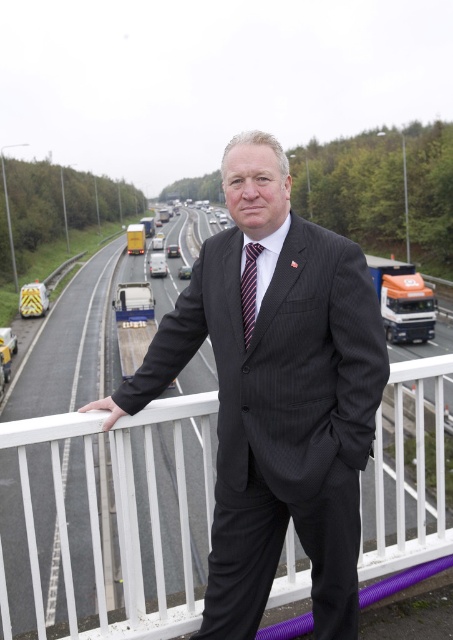
Does black pinstripe suit at center have a greater width compared to striped fabric tie at center?

Yes, black pinstripe suit at center is wider than striped fabric tie at center.

Can you confirm if black pinstripe suit at center is positioned above striped fabric tie at center?

No, black pinstripe suit at center is not above striped fabric tie at center.

Based on the photo, who is more distant from viewer, (226, 376) or (246, 244)?

Point (246, 244)

This screenshot has height=640, width=453. Find the location of `black pinstripe suit at center`. black pinstripe suit at center is located at coordinates (276, 396).

Who is lower down, white metal railing at center or striped fabric tie at center?

white metal railing at center is below.

Does white metal railing at center have a greater width compared to striped fabric tie at center?

Indeed, white metal railing at center has a greater width compared to striped fabric tie at center.

This screenshot has width=453, height=640. In order to click on white metal railing at center in this screenshot , I will do `click(112, 522)`.

The width and height of the screenshot is (453, 640). What are the coordinates of `white metal railing at center` in the screenshot? It's located at (112, 522).

Is point (232, 568) in front of point (428, 362)?

Yes, point (232, 568) is in front of point (428, 362).

Where is `black pinstripe suit at center`? Image resolution: width=453 pixels, height=640 pixels. black pinstripe suit at center is located at coordinates (276, 396).

Is point (348, 550) farther from viewer compared to point (149, 564)?

No, it is in front of (149, 564).

The height and width of the screenshot is (640, 453). What are the coordinates of `black pinstripe suit at center` in the screenshot? It's located at (276, 396).